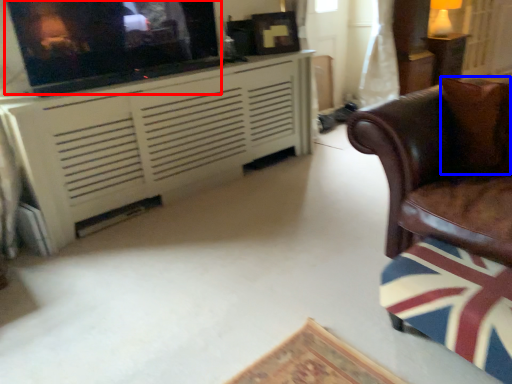
Question: Among these objects, which one is nearest to the camera, tv show (highlighted by a red box) or pillow (highlighted by a blue box)?

Choices:
 (A) tv show
 (B) pillow

Answer: (B)